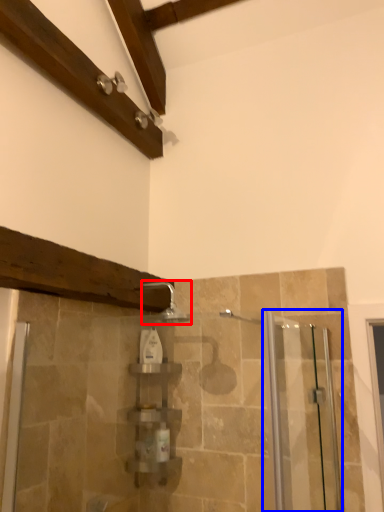
Question: Among these objects, which one is nearest to the camera, shower (highlighted by a red box) or screen door (highlighted by a blue box)?

Choices:
 (A) shower
 (B) screen door

Answer: (B)